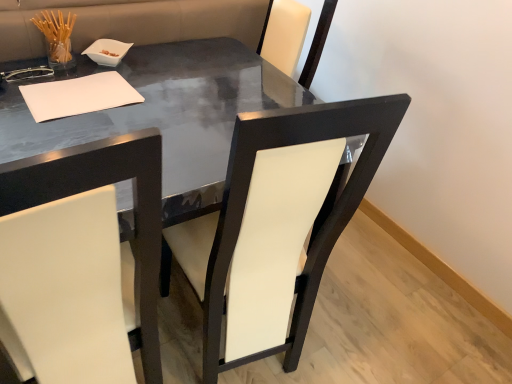
I want to click on free region under white paper at upper left (from a real-world perspective), so click(79, 97).